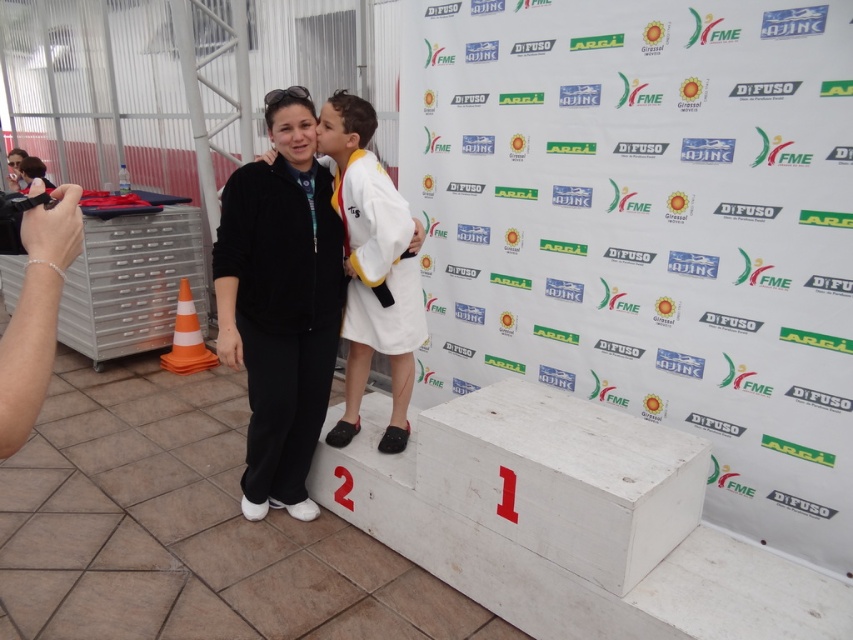
Question: Which point is closer to the camera?

Choices:
 (A) white cotton kimono at center
 (B) black matte jacket at center

Answer: (B)

Question: Which point is closer to the camera taking this photo?

Choices:
 (A) (300, 106)
 (B) (370, 330)

Answer: (A)

Question: Is black matte jacket at center above white cotton kimono at center?

Choices:
 (A) yes
 (B) no

Answer: (B)

Question: From the image, what is the correct spatial relationship of black matte jacket at center in relation to white cotton kimono at center?

Choices:
 (A) above
 (B) below

Answer: (B)

Question: Which point is closer to the camera taking this photo?

Choices:
 (A) (393, 216)
 (B) (323, 369)

Answer: (A)

Question: Is black matte jacket at center below white cotton kimono at center?

Choices:
 (A) no
 (B) yes

Answer: (B)